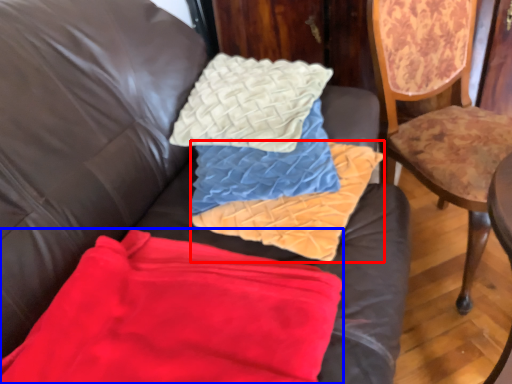
Question: Among these objects, which one is nearest to the camera, material (highlighted by a red box) or material (highlighted by a blue box)?

Choices:
 (A) material
 (B) material

Answer: (B)